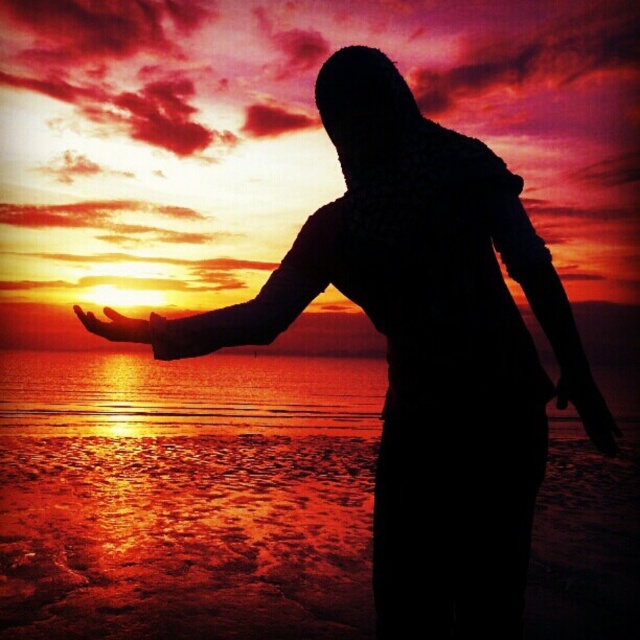
You are a photographer trying to capture the sunset reflection on the shiny reflective water at center. If your camera can focus up to 20 meters, will you be able to capture the reflection clearly?

The shiny reflective water at center is 20.63 meters away from the camera, which exceeds the camera focus limit of 20 meters. Therefore, the reflection may not be captured clearly.

You are a photographer trying to capture the sunset reflection on the water. You notice the shiny reflective water at center and the matte orange hand at lower left in your frame. Which object should you adjust your camera focus to capture the reflection clearly?

You should focus on the shiny reflective water at center because it is positioned to the left of the matte orange hand at lower left, allowing the reflection to be captured clearly in the calm water.